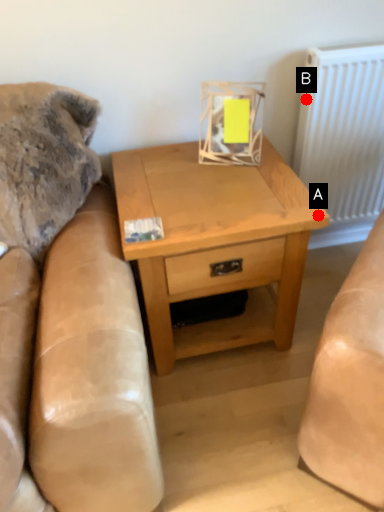
Question: Two points are circled on the image, labeled by A and B beside each circle. Which of the following is the closest to the observer?

Choices:
 (A) A is closer
 (B) B is closer

Answer: (A)